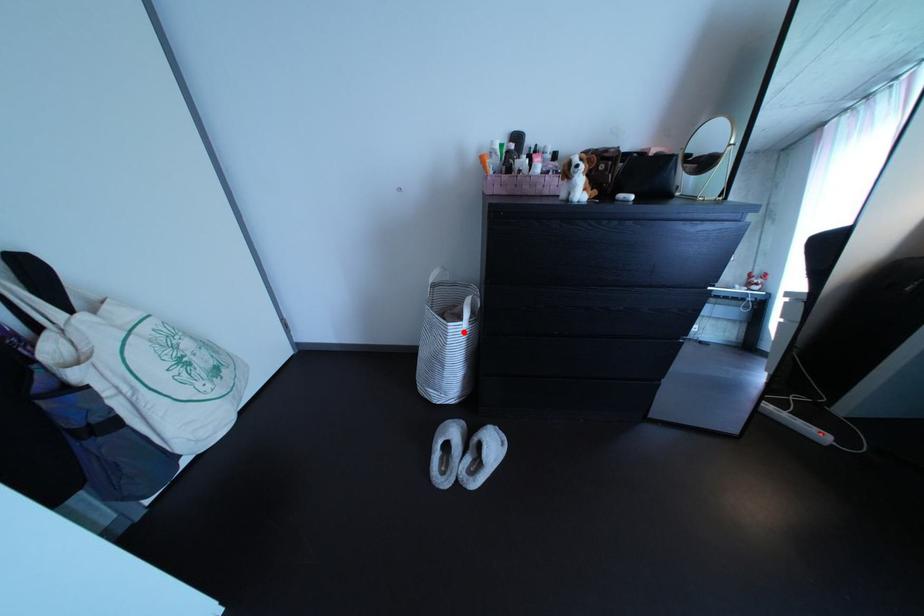
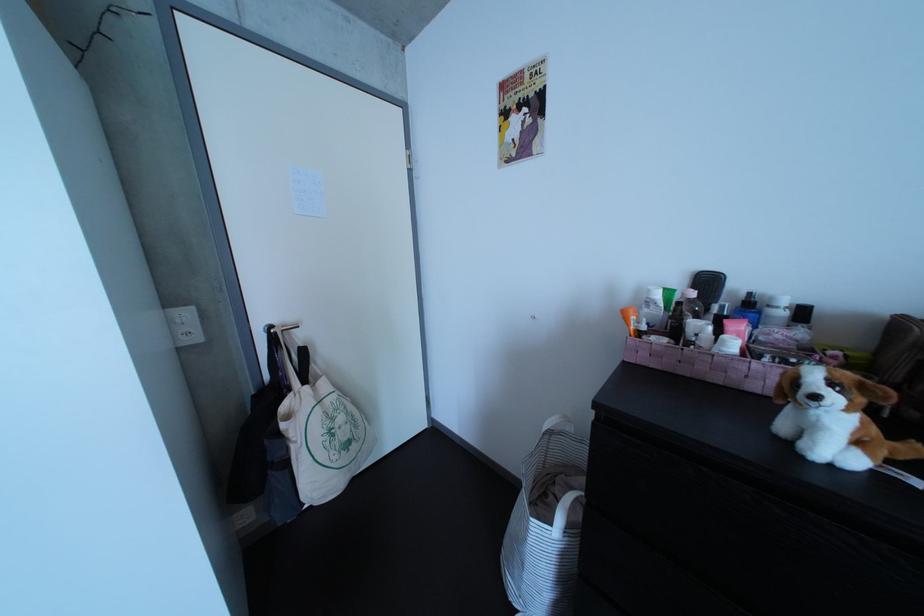
In the second image, find the point that corresponds to the highlighted location in the first image.

(545, 527)